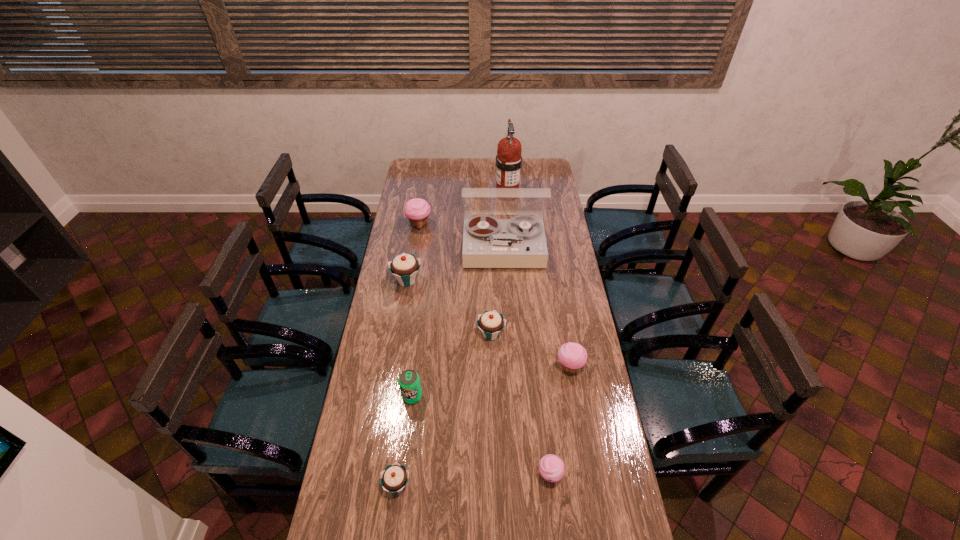
Locate an element on the screen. The height and width of the screenshot is (540, 960). vacant space located 0.390m on the front-facing side of the pop soda is located at coordinates (396, 528).

Image resolution: width=960 pixels, height=540 pixels. Find the location of `vacant space located 0.230m on the left of the second farthest pink cupcake`. vacant space located 0.230m on the left of the second farthest pink cupcake is located at coordinates (494, 368).

Find the location of a particular element. blank space located 0.250m on the front of the fifth farthest object is located at coordinates (492, 403).

Locate an element on the screen. Image resolution: width=960 pixels, height=540 pixels. free space located 0.200m on the right of the nearest teal cupcake is located at coordinates (475, 485).

Identify the location of vacant space positioned on the front of the smallest pink cupcake. (555, 525).

This screenshot has width=960, height=540. In order to click on pop soda positioned at the left edge in this screenshot , I will do `click(409, 381)`.

Find the location of a particular element. The width and height of the screenshot is (960, 540). record player that is positioned at the right edge is located at coordinates (520, 242).

Locate an element on the screen. Image resolution: width=960 pixels, height=540 pixels. cupcake that is at the right edge is located at coordinates (572, 356).

Identify the location of free space at the far edge of the desktop. click(x=492, y=179).

Identify the location of vacant space at the left edge. (405, 245).